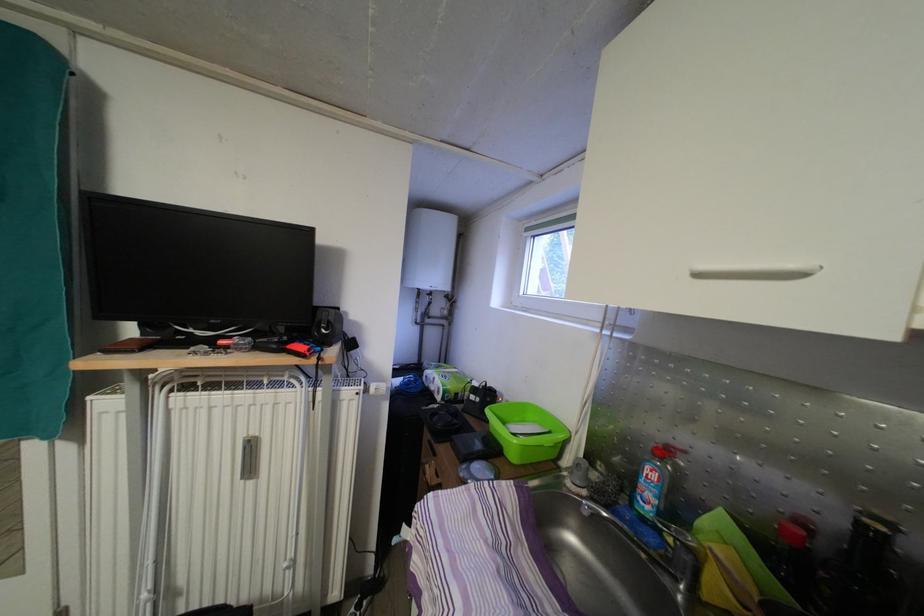
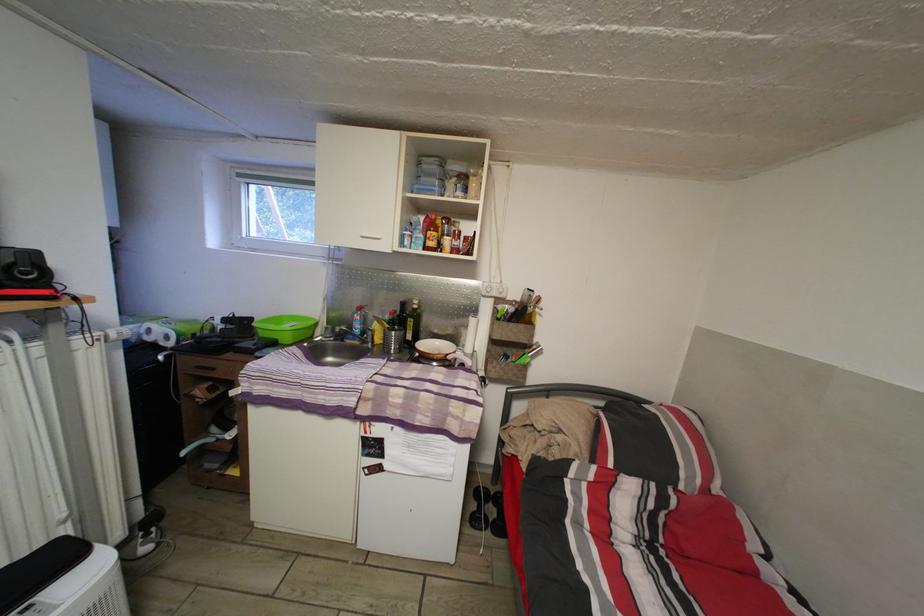
Where in the second image is the point corresponding to [526,302] from the first image?

(249, 244)